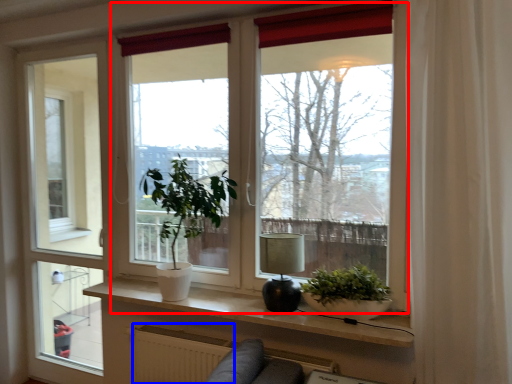
Question: Among these objects, which one is farthest to the camera, window (highlighted by a red box) or radiator (highlighted by a blue box)?

Choices:
 (A) window
 (B) radiator

Answer: (A)